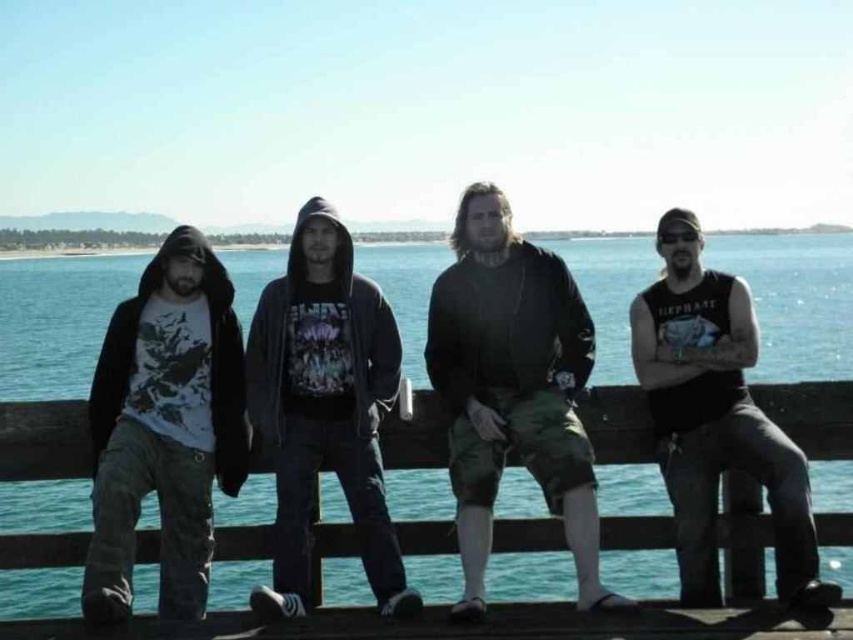
You are a photographer trying to capture the scene of the blue water at center and the black tank top at right. Which object would appear bigger in your photo?

The blue water at center would appear bigger in the photo since it is larger in size than the black tank top at right.